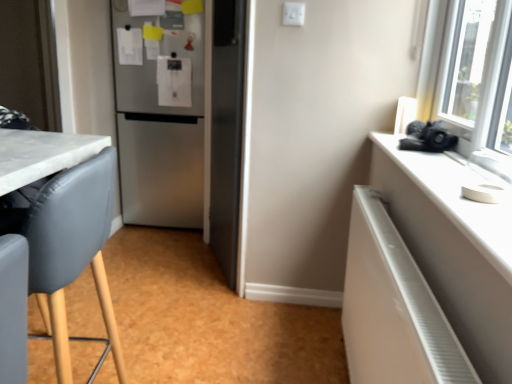
Question: Should I look upward or downward to see matte gray chair at left?

Choices:
 (A) down
 (B) up

Answer: (A)

Question: Considering the relative positions of satin silver refrigerator at center and matte gray chair at left in the image provided, is satin silver refrigerator at center behind matte gray chair at left?

Choices:
 (A) no
 (B) yes

Answer: (B)

Question: Considering the relative positions of satin silver refrigerator at center and matte gray chair at left in the image provided, is satin silver refrigerator at center to the left of matte gray chair at left from the viewer's perspective?

Choices:
 (A) no
 (B) yes

Answer: (A)

Question: Is satin silver refrigerator at center placed right next to matte gray chair at left?

Choices:
 (A) no
 (B) yes

Answer: (A)

Question: Is matte gray chair at left completely or partially inside satin silver refrigerator at center?

Choices:
 (A) yes
 (B) no

Answer: (B)

Question: Considering the relative sizes of satin silver refrigerator at center and matte gray chair at left in the image provided, is satin silver refrigerator at center shorter than matte gray chair at left?

Choices:
 (A) no
 (B) yes

Answer: (A)

Question: From a real-world perspective, is satin silver refrigerator at center beneath matte gray chair at left?

Choices:
 (A) no
 (B) yes

Answer: (A)

Question: Does matte gray chair at left have a larger size compared to white glossy radiator at right?

Choices:
 (A) yes
 (B) no

Answer: (A)

Question: Is matte gray chair at left at the left side of white glossy radiator at right?

Choices:
 (A) yes
 (B) no

Answer: (A)

Question: Is matte gray chair at left surrounding white glossy radiator at right?

Choices:
 (A) yes
 (B) no

Answer: (B)

Question: From the image's perspective, is matte gray chair at left located beneath white glossy radiator at right?

Choices:
 (A) yes
 (B) no

Answer: (B)

Question: Does matte gray chair at left have a greater width compared to white glossy radiator at right?

Choices:
 (A) no
 (B) yes

Answer: (B)

Question: Is matte gray chair at left facing away from white glossy radiator at right?

Choices:
 (A) yes
 (B) no

Answer: (A)

Question: From a real-world perspective, is white glossy radiator at right under matte gray chair at left?

Choices:
 (A) yes
 (B) no

Answer: (A)